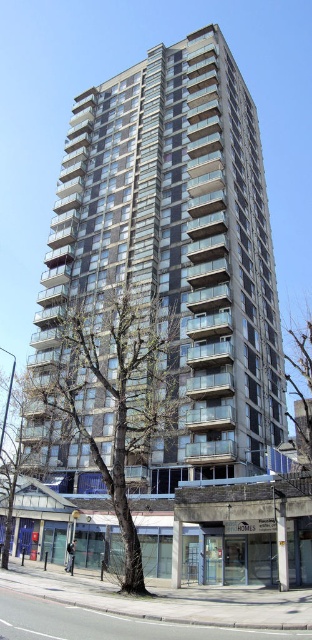
The image size is (312, 640). Describe the element at coordinates (178, 243) in the screenshot. I see `glassy concrete building at center` at that location.

Is point (128, 148) less distant than point (302, 339)?

Yes, point (128, 148) is closer to viewer.

Locate an element on the screen. glassy concrete building at center is located at coordinates (178, 243).

This screenshot has height=640, width=312. Identify the location of glassy concrete building at center. (178, 243).

Does glassy concrete building at center have a greater width compared to bare wood tree at center?

Yes.

Describe the element at coordinates (178, 243) in the screenshot. I see `glassy concrete building at center` at that location.

In order to click on glassy concrete building at center in this screenshot , I will do `click(178, 243)`.

Does bare wood tree at center have a larger size compared to green leafy tree at center?

Actually, bare wood tree at center might be smaller than green leafy tree at center.

Is bare wood tree at center to the left of green leafy tree at center from the viewer's perspective?

Yes, bare wood tree at center is to the left of green leafy tree at center.

Is point (151, 378) less distant than point (297, 387)?

Yes.

Identify the location of bare wood tree at center. (113, 394).